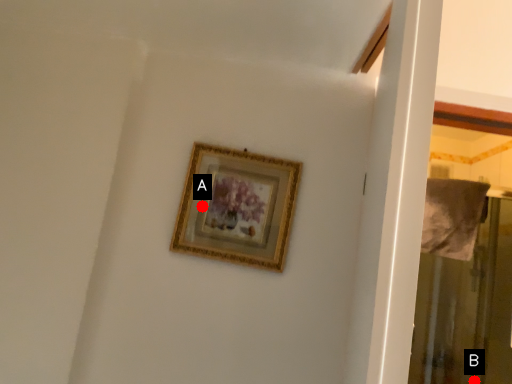
Question: Two points are circled on the image, labeled by A and B beside each circle. Which of the following is the farthest from the observer?

Choices:
 (A) A is further
 (B) B is further

Answer: (B)